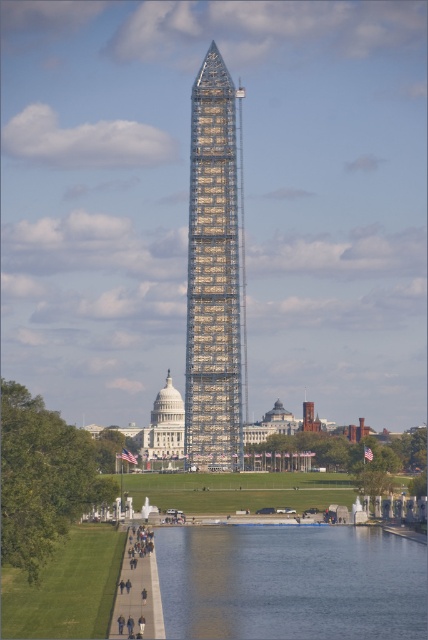
You are an architect visiting the Washington Monument. You notice the shiny glass tower at center and the dark gray concrete people at lower center. Which object appears wider in the image?

The shiny glass tower at center appears wider than the dark gray concrete people at lower center because its width is larger than theirs according to the description.

You are standing on the paved pathway next to the reflective pool and see the shiny glass tower at center and the dark gray concrete people at lower center. Which object is closer to you?

The dark gray concrete people at lower center are closer to you because the shiny glass tower at center is further away.

You are standing on the paved pathway next to the reflective pool and see the shiny glass tower at center and the dark gray concrete people at lower center. Which object is positioned higher in the image?

The shiny glass tower at center is positioned higher in the image than the dark gray concrete people at lower center.